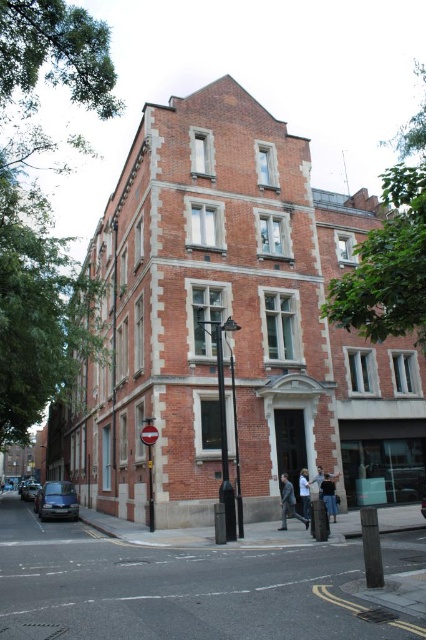
Question: Does dark gray jacket at center appear under denim pants at lower center?

Choices:
 (A) yes
 (B) no

Answer: (B)

Question: Estimate the real-world distances between objects in this image. Which object is farther from the dark gray jacket at center?

Choices:
 (A) denim pants at lower center
 (B) metallic blue car at lower left
 (C) light gray fabric jacket at center

Answer: (B)

Question: Does denim pants at lower center have a lesser width compared to white cotton shirt at center?

Choices:
 (A) yes
 (B) no

Answer: (B)

Question: Does white cotton shirt at center appear under light gray fabric jacket at center?

Choices:
 (A) yes
 (B) no

Answer: (B)

Question: Among these objects, which one is nearest to the camera?

Choices:
 (A) denim pants at lower center
 (B) light gray fabric jacket at center

Answer: (B)

Question: Which object is the farthest from the metallic blue car at lower left?

Choices:
 (A) light gray fabric jacket at center
 (B) white cotton shirt at center
 (C) dark gray jacket at center
 (D) denim pants at lower center

Answer: (B)